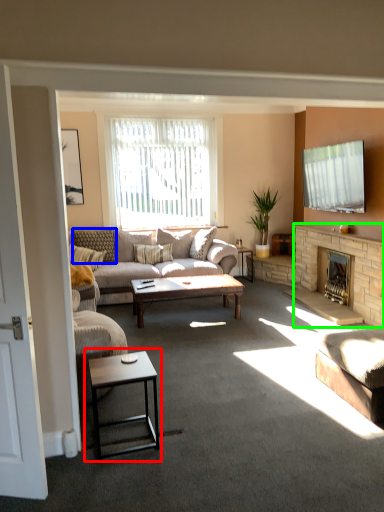
Question: Considering the real-world distances, which object is closest to coffee table (highlighted by a red box)? pillow (highlighted by a blue box) or fireplace (highlighted by a green box).

Choices:
 (A) pillow
 (B) fireplace

Answer: (B)